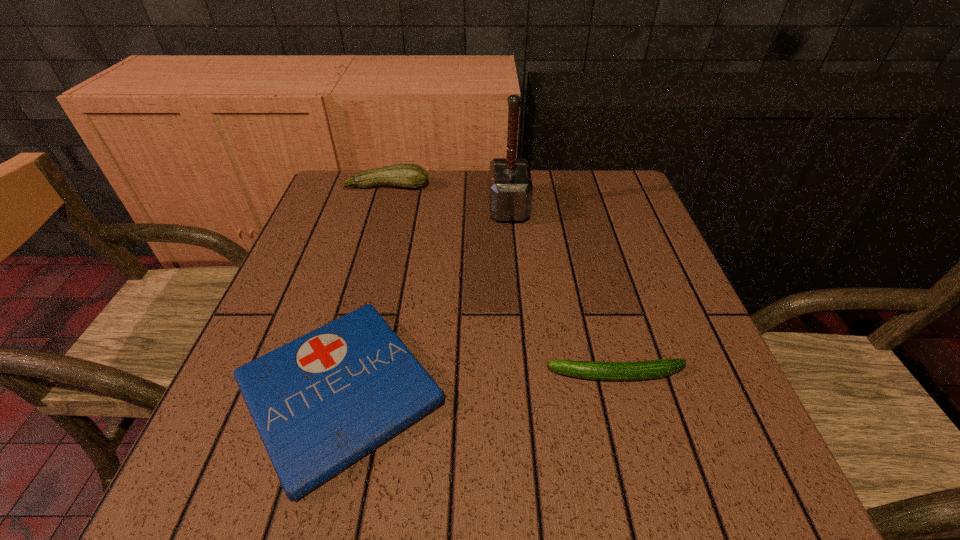
This screenshot has width=960, height=540. I want to click on vacant space at the far edge of the desktop, so click(x=456, y=214).

Identify the location of free space at the left edge. This screenshot has width=960, height=540. (351, 294).

In the image, there is a desktop. Identify the location of vacant space at the right edge. (639, 388).

Find the location of a particular element. The image size is (960, 540). vacant space at the far left corner of the desktop is located at coordinates (354, 218).

Locate an element on the screen. empty location between the farther zucchini and the hammer is located at coordinates (448, 197).

Locate an element on the screen. The height and width of the screenshot is (540, 960). free area in between the second tallest object and the first-aid kit is located at coordinates (364, 289).

At what (x,y) coordinates should I click in order to perform the action: click on free space between the tallest object and the left zucchini. Please return your answer as a coordinate pair (x, y). The width and height of the screenshot is (960, 540). Looking at the image, I should click on (448, 197).

Where is `unoccupied position between the taller zucchini and the right zucchini`? This screenshot has width=960, height=540. unoccupied position between the taller zucchini and the right zucchini is located at coordinates (501, 281).

You are a GUI agent. You are given a task and a screenshot of the screen. Output one action in this format:
    pyautogui.click(x=<x>, y=<y>)
    Task: Click on the vacant point located between the nearer zucchini and the first-aid kit
    The image size is (960, 540).
    Given the screenshot: What is the action you would take?
    pyautogui.click(x=478, y=383)

This screenshot has width=960, height=540. What are the coordinates of `unoccupied area between the third shortest object and the nearer zucchini` in the screenshot? It's located at (501, 281).